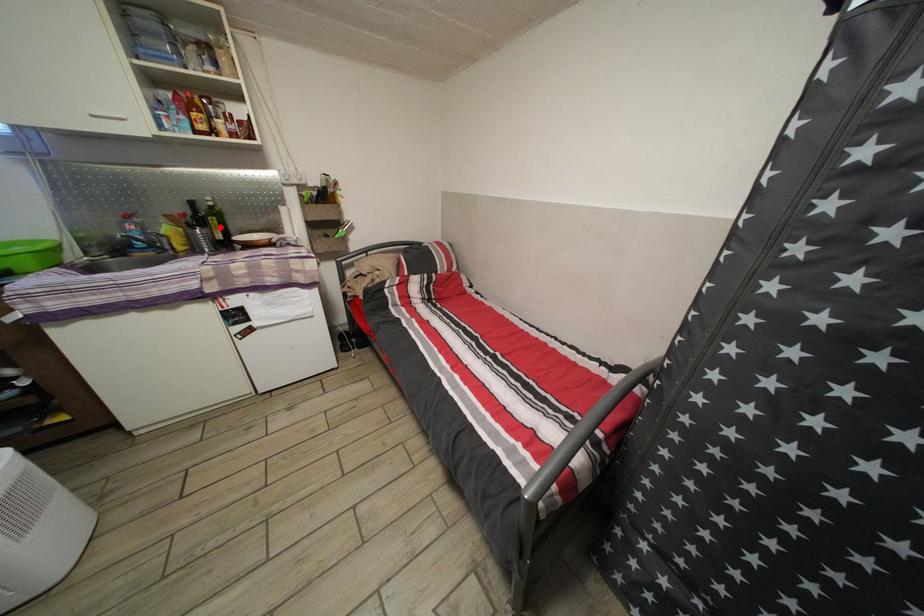
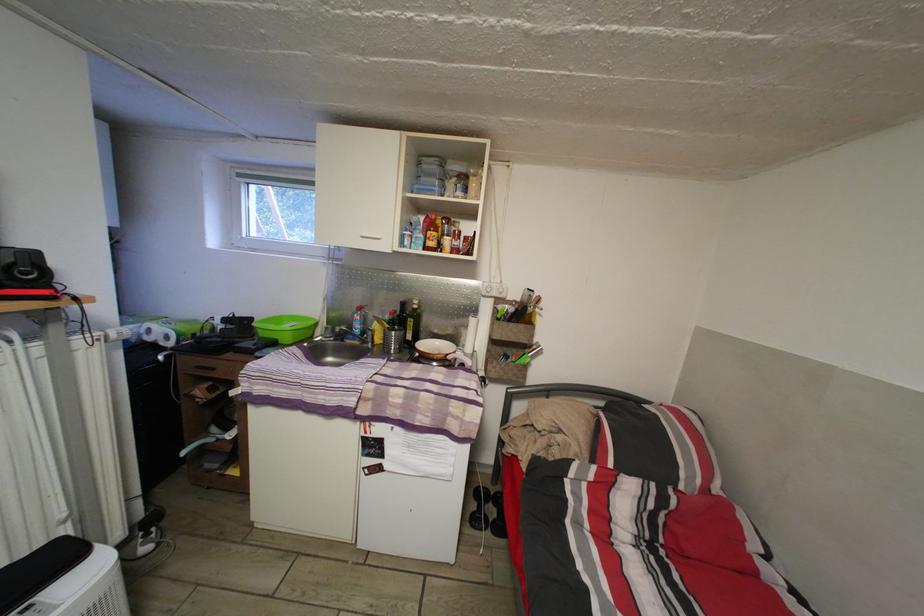
The point at the highlighted location is marked in the first image. Where is the corresponding point in the second image?

(418, 329)